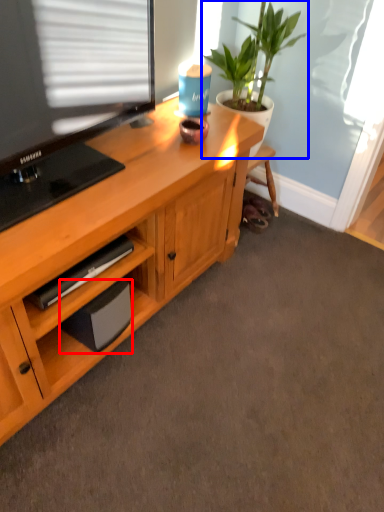
Question: Among these objects, which one is nearest to the camera, speaker (highlighted by a red box) or houseplant (highlighted by a blue box)?

Choices:
 (A) speaker
 (B) houseplant

Answer: (A)